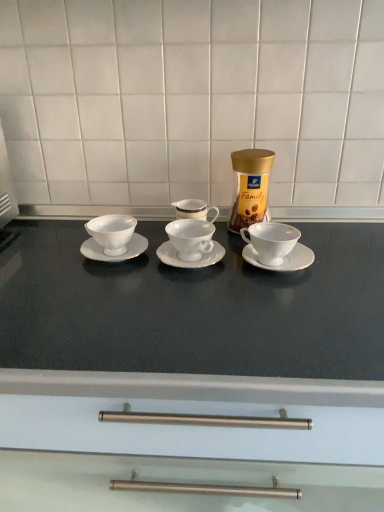
Find the location of `blank space to the left of white porcelain saucer at left, the 1th saucer in the left-to-right sequence`. blank space to the left of white porcelain saucer at left, the 1th saucer in the left-to-right sequence is located at coordinates (42, 250).